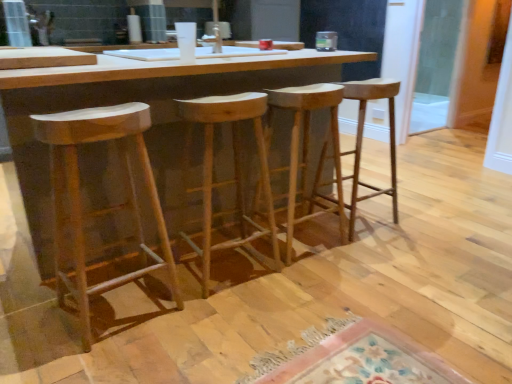
Where is `vacant area located to the right-hand side of natural wood stool at left, which ranks as the fourth stool in right-to-left order`? The image size is (512, 384). vacant area located to the right-hand side of natural wood stool at left, which ranks as the fourth stool in right-to-left order is located at coordinates (204, 324).